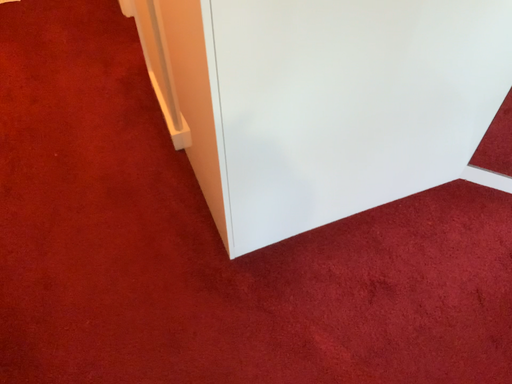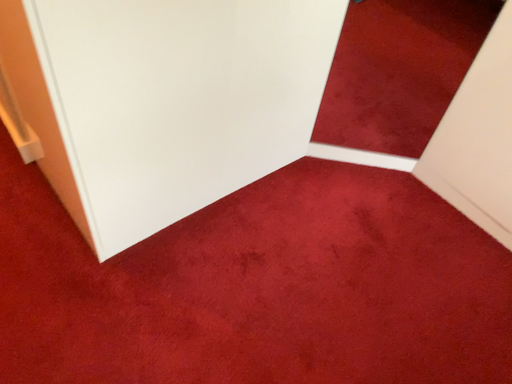
Question: Which way did the camera rotate in the video?

Choices:
 (A) rotated right
 (B) rotated left

Answer: (A)